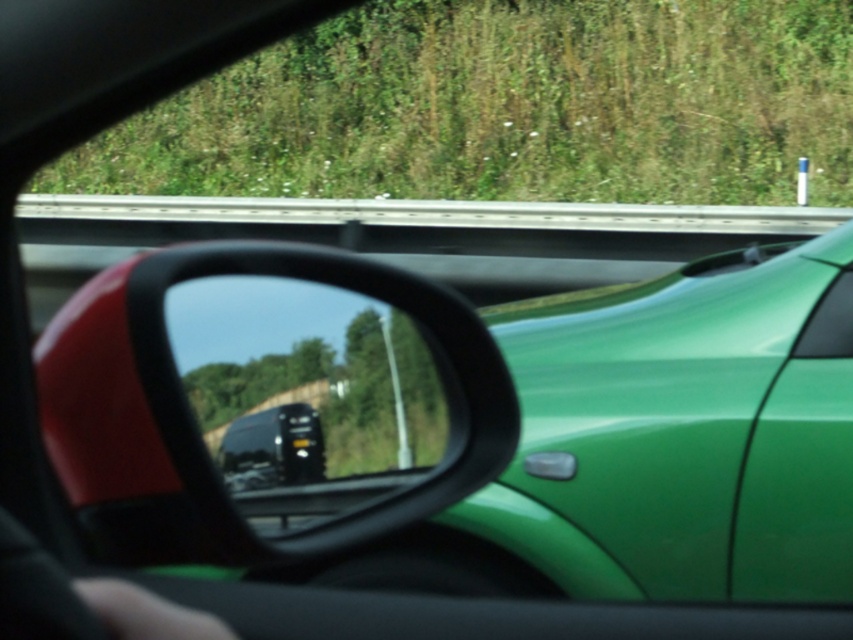
You are sitting in the driver seat of the car shown in the image. You see two points marked on the side mirror reflection. The first point is at coordinates point [276,524] and the second point is at point [844,308]. From your current position, which point is closer to you?

Point [276,524] is in front of point [844,308], so the first point is closer to you.

You are a passenger in the car and want to check the reflection in the black glossy mirror at center and the green glossy car window at upper right. Which object allows you to see a larger portion of the road behind the car?

The black glossy mirror at center is much taller than the green glossy car window at upper right, so it allows you to see a larger portion of the road behind the car.

You are sitting in the driver seat of the car and want to adjust the black glossy mirror at center so it doesn not block your view of the green glossy car window at upper right. Is this possible?

The black glossy mirror at center is in front of the green glossy car window at upper right, so adjusting it might allow you to avoid blocking the view.